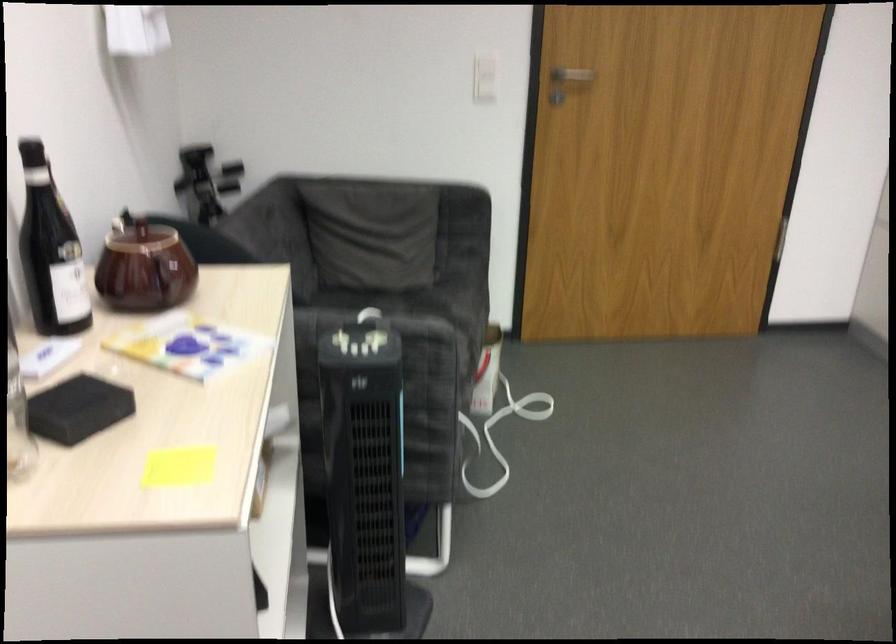
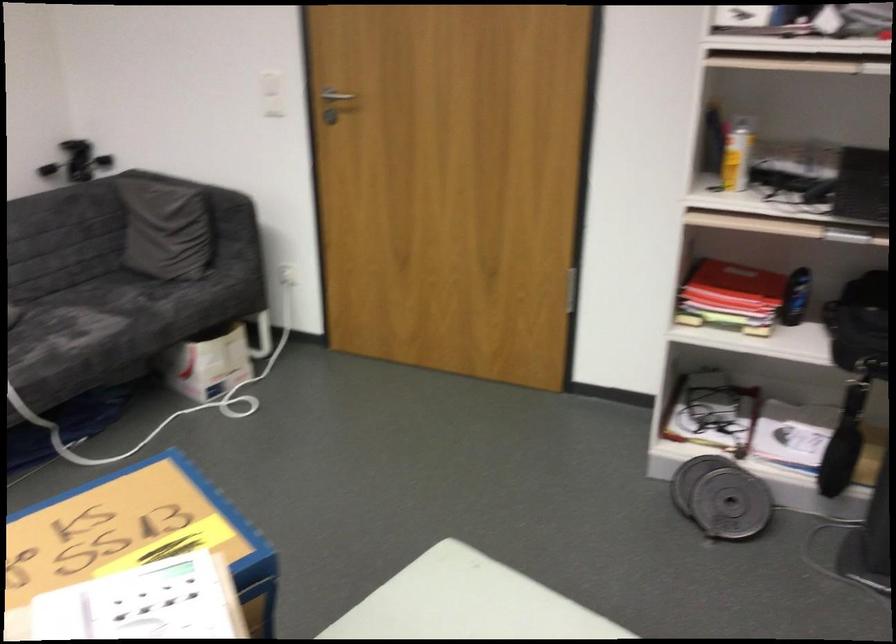
Locate, in the second image, the point that corresponds to point 565,71 in the first image.

(331, 98)